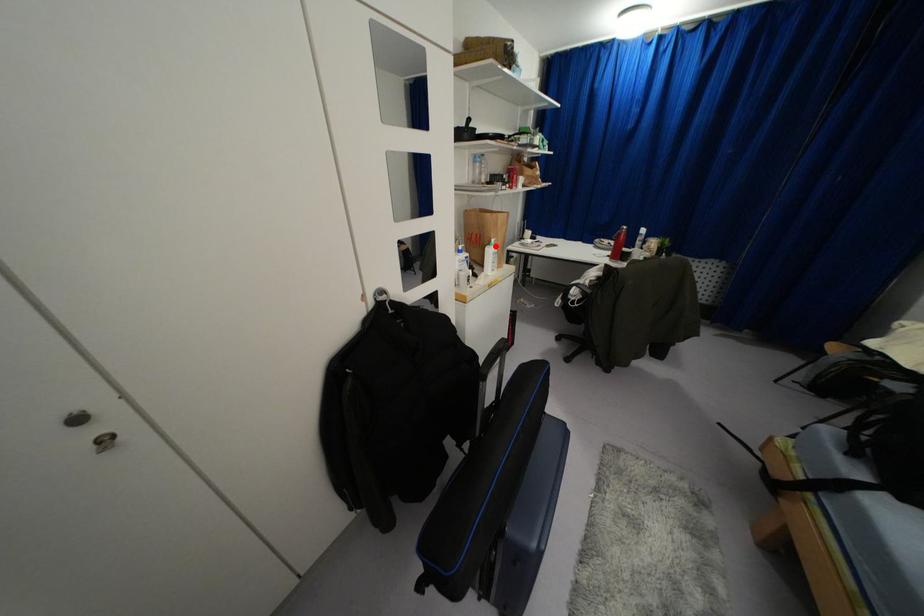
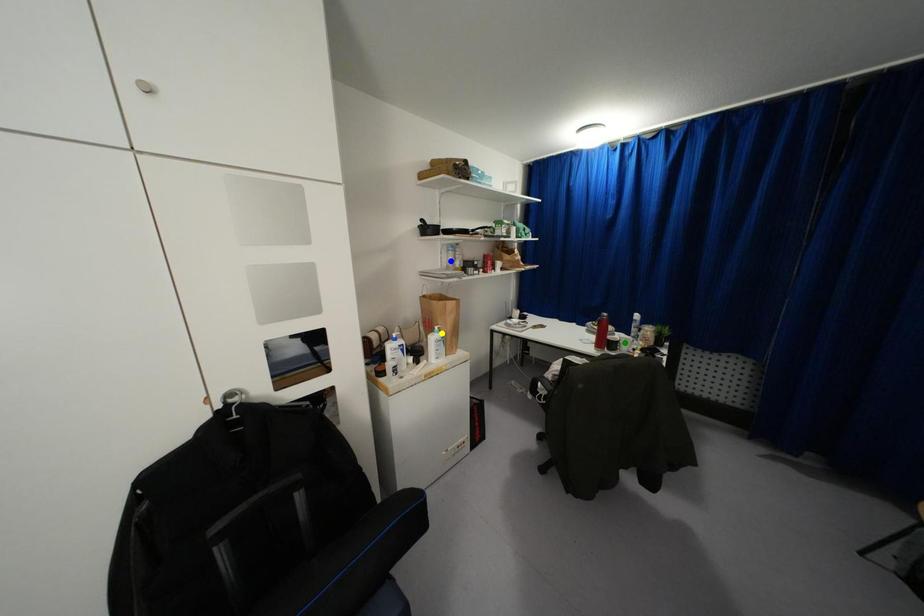
Question: I am providing you with two images of the same scene from different viewpoints. A red point is marked on the first image. You are given multiple points on the second image. Which mark in image 2 goes with the point in image 1?

Choices:
 (A) green point
 (B) blue point
 (C) yellow point

Answer: (C)